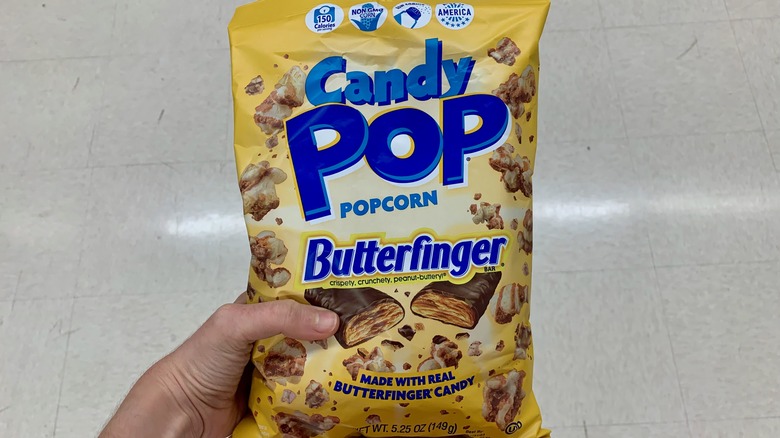
Identify the location of floor. (97, 290).